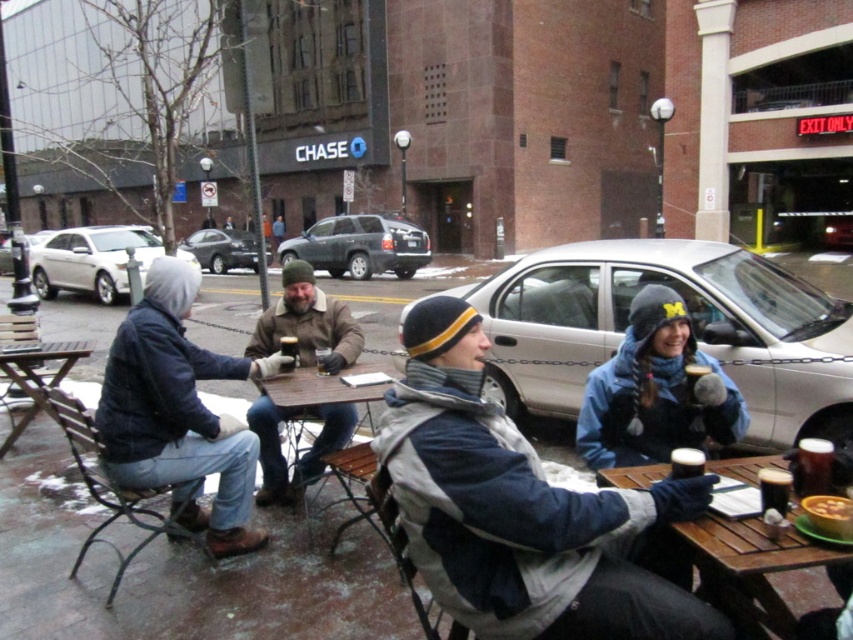
You are a delivery person who needs to park your delivery van near the wooden table at center and the satin black suv at center. Based on their sizes, which object should you avoid placing your van too close to?

The wooden table at center is larger in size than the satin black suv at center, so you should avoid placing your van too close to the wooden table at center to ensure there is enough space.

You are a delivery person with a box that is 2 meters long. You need to place the box between the wooden table at lower right and the brown leather jacket at center. Is there enough space to place the box horizontally?

The wooden table at lower right is 2.31 meters from the brown leather jacket at center. Since the box is 2 meters long, there is enough space to place it horizontally between them.

You are a delivery person trying to park your delivery van between the wooden table at center and the satin black suv at center. Can you fit your van there if it is 6 meters long?

The wooden table at center is below the satin black suv at center, which means they are positioned vertically. Since the van requires horizontal space to park between them, there isn not enough space as they are stacked vertically.